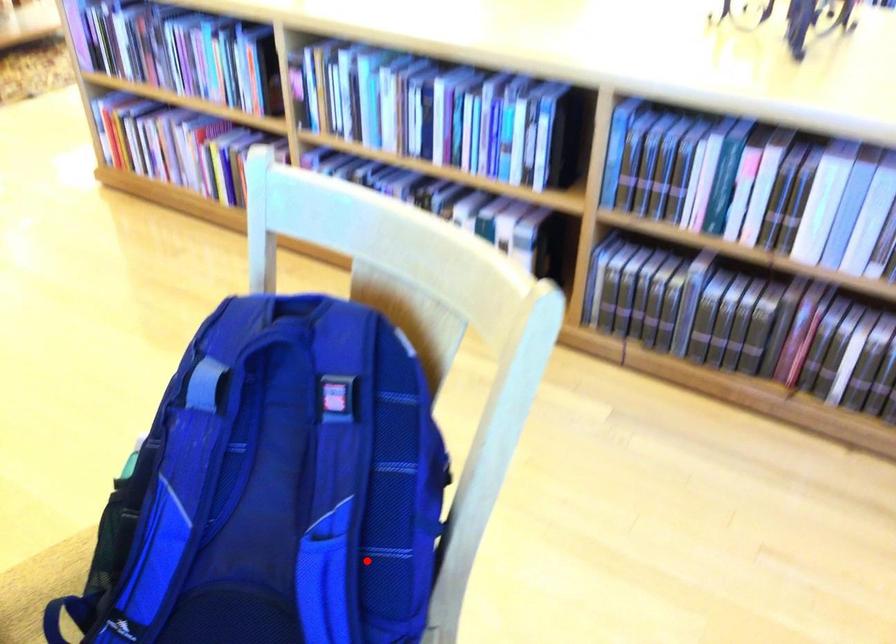
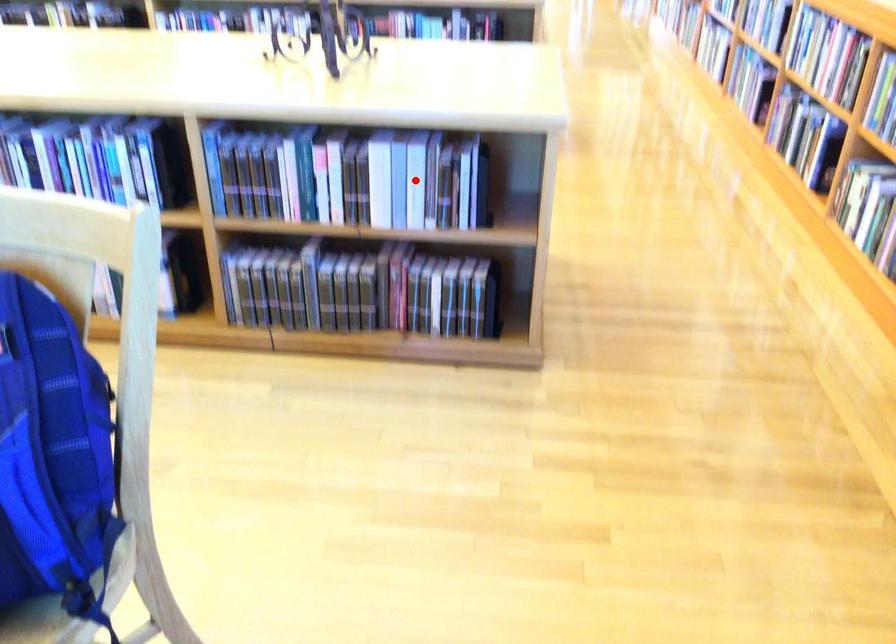
I am providing you with two images of the same scene from different viewpoints. A red point is marked on the first image and another point is marked on the second image. Is the red point in image1 aligned with the point shown in image2?

No